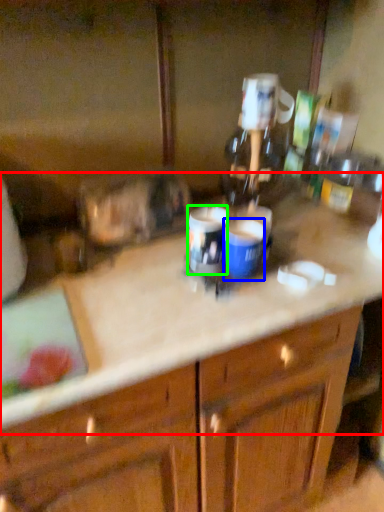
Question: Estimate the real-world distances between objects in this image. Which object is farther from counter top (highlighted by a red box), beverage (highlighted by a blue box) or beverage (highlighted by a green box)?

Choices:
 (A) beverage
 (B) beverage

Answer: (A)